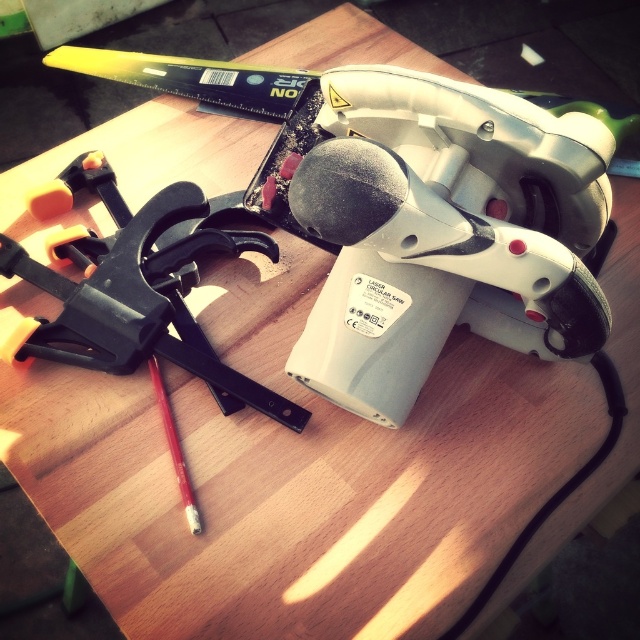
You are organizing tools on a workbench and need to place the black plastic clamp at upper left and the red wood pencil at center. If you want to stack them vertically, which one should go on the bottom to ensure stability?

The black plastic clamp at upper left is taller than the red wood pencil at center, so it should be placed on the bottom to ensure stability when stacking them vertically.

What is located at the coordinates point (138,289)?

The black plastic clamp at upper left is located at point (138,289).